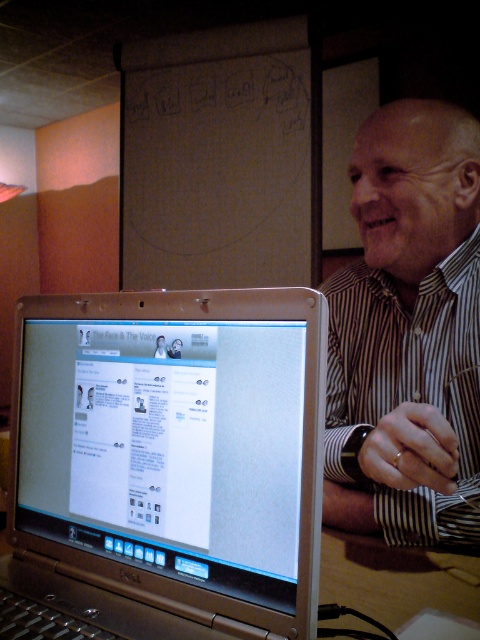
You are organizing a photo shoot and need to position a model in front of the striped shirt at right and the silver metallic laptop at center. According to the scene, which object should be placed to the left of the other to match the original image?

The silver metallic laptop at center should be placed to the left of the striped shirt at right to match the original image.

You are trying to decide whether to place a new rectangular document on the desk next to the silver metallic laptop at center and the striped shirt at right. The document is 12 inches wide. Based on the scene, can you determine if there is enough space between the two objects to fit the document?

The silver metallic laptop at center is wider than the striped shirt at right. Since the document is 12 inches wide, and the space between them depends on their widths, but without exact measurements of the space itself, it is uncertain if the document will fit. However, if the total available space between them is at least 12 inches, it would fit. The description only states the laptop is wider than the shirt, but not the exact dimensions or spacing between them.

You are a photographer setting up a shot of the man in the scene. You want to ensure that both the silver metallic laptop at center and the striped shirt at right are clearly visible in the frame. Based on their positions, which object should you focus on first to ensure both are in focus?

The silver metallic laptop at center is in front of the striped shirt at right, so focusing on the laptop first will help ensure both are in focus since it is closer to the camera.